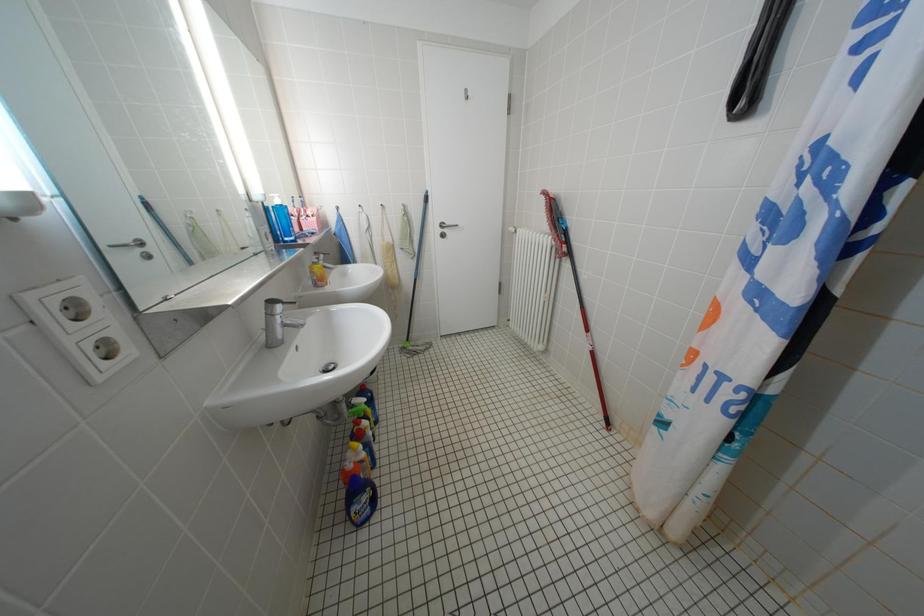
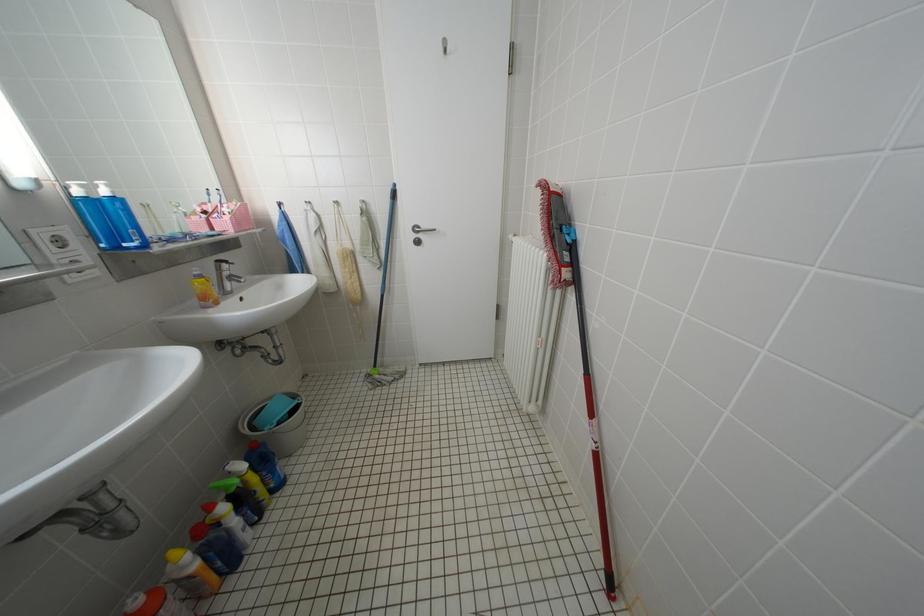
Question: The camera is either moving clockwise (left) or counter-clockwise (right) around the object. The first image is from the beginning of the video and the second image is from the end. Is the camera moving left or right when shooting the video?

Choices:
 (A) Left
 (B) Right

Answer: (B)